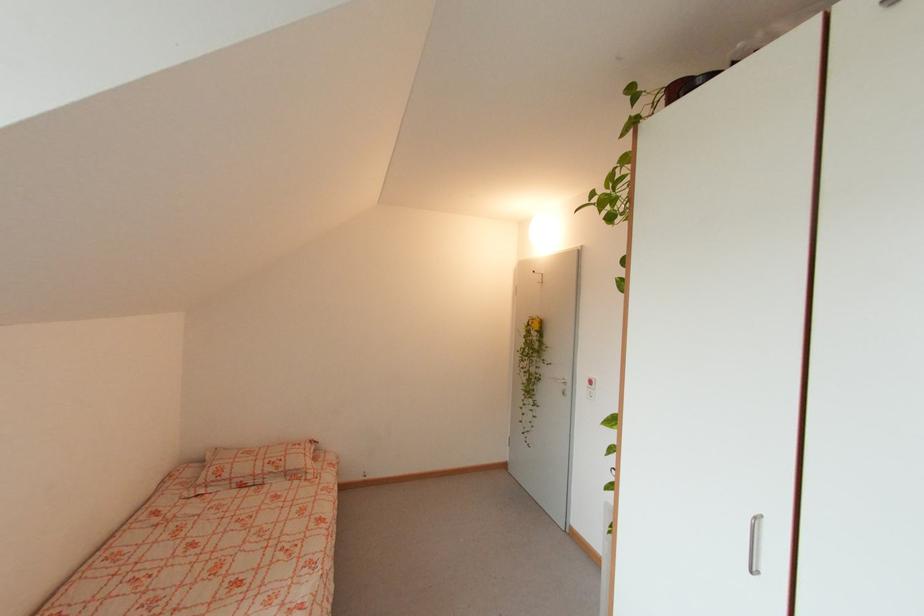
This screenshot has width=924, height=616. Describe the element at coordinates (755, 544) in the screenshot. I see `the cabinet handle` at that location.